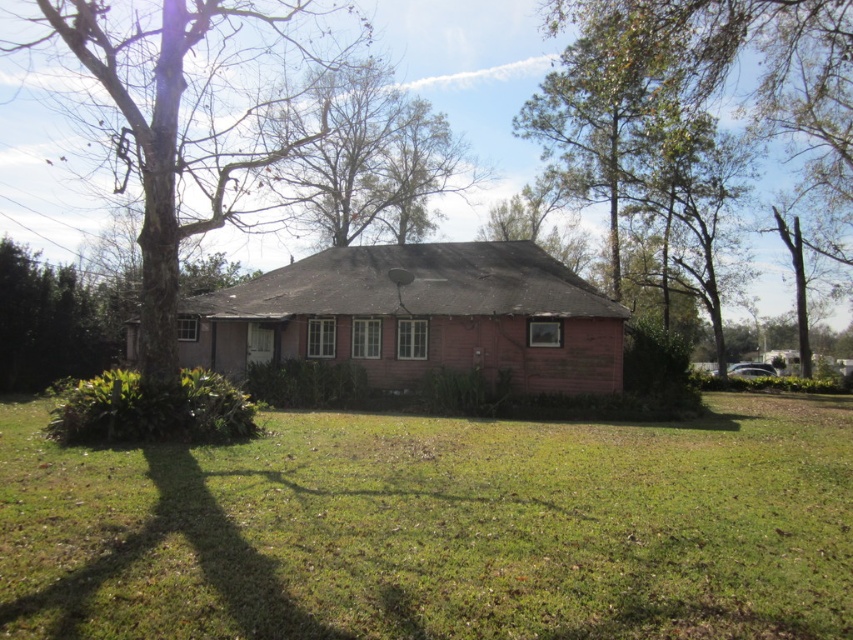
Can you confirm if green grass at center is smaller than pink wood house at center?

Indeed, green grass at center has a smaller size compared to pink wood house at center.

Does green grass at center appear over pink wood house at center?

No, green grass at center is not above pink wood house at center.

Is point (825, 554) positioned in front of point (523, 260)?

Yes, point (825, 554) is in front of point (523, 260).

What are the coordinates of `green grass at center` in the screenshot? It's located at (437, 529).

Is brown wood tree at center shorter than green leafy tree at center?

No.

How distant is brown wood tree at center from green leafy tree at center?

brown wood tree at center and green leafy tree at center are 23.26 meters apart.

The height and width of the screenshot is (640, 853). What do you see at coordinates (468, 80) in the screenshot? I see `brown wood tree at center` at bounding box center [468, 80].

Where is `brown wood tree at center`? The width and height of the screenshot is (853, 640). brown wood tree at center is located at coordinates (468, 80).

Is point (154, 250) behind point (845, 99)?

No.

Which is more to the right, brown rough bark tree at left or green leafy tree at center?

green leafy tree at center

Locate an element on the screen. The width and height of the screenshot is (853, 640). brown rough bark tree at left is located at coordinates (184, 122).

I want to click on brown rough bark tree at left, so click(184, 122).